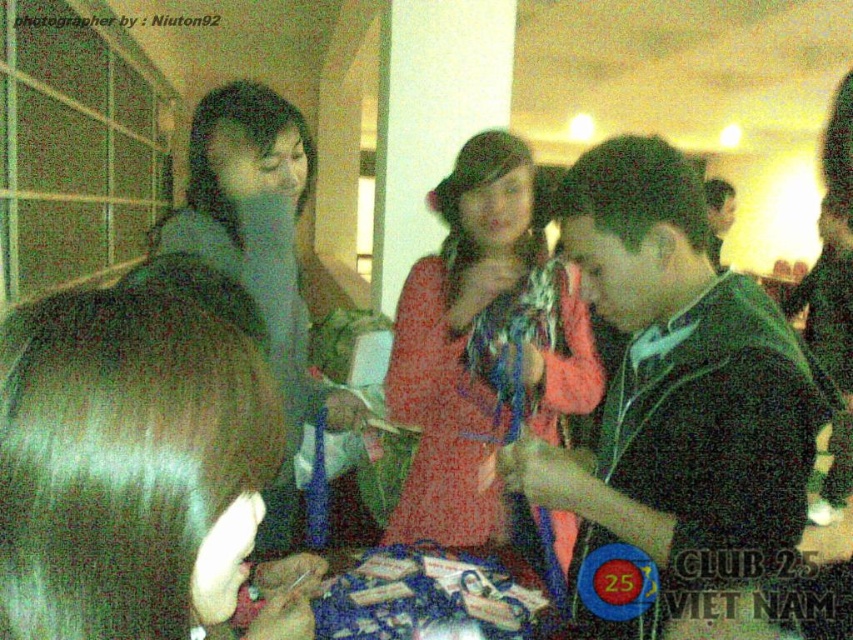
Is brown shiny hair at center thinner than matte gray hoodie at center?

Correct, brown shiny hair at center's width is less than matte gray hoodie at center's.

Where is `brown shiny hair at center`? This screenshot has height=640, width=853. brown shiny hair at center is located at coordinates (122, 458).

Is matte red dress at center shorter than matte gray hoodie at center?

Correct, matte red dress at center is not as tall as matte gray hoodie at center.

Is matte red dress at center below matte gray hoodie at center?

Incorrect, matte red dress at center is not positioned below matte gray hoodie at center.

This screenshot has width=853, height=640. Find the location of `matte red dress at center`. matte red dress at center is located at coordinates (459, 340).

Where is `matte red dress at center`? matte red dress at center is located at coordinates (459, 340).

Consider the image. Can you confirm if brown shiny hair at center is taller than matte red dress at center?

No, brown shiny hair at center is not taller than matte red dress at center.

Is point (73, 384) positioned behind point (428, 356)?

No, it is in front of (428, 356).

The height and width of the screenshot is (640, 853). What are the coordinates of `brown shiny hair at center` in the screenshot? It's located at (122, 458).